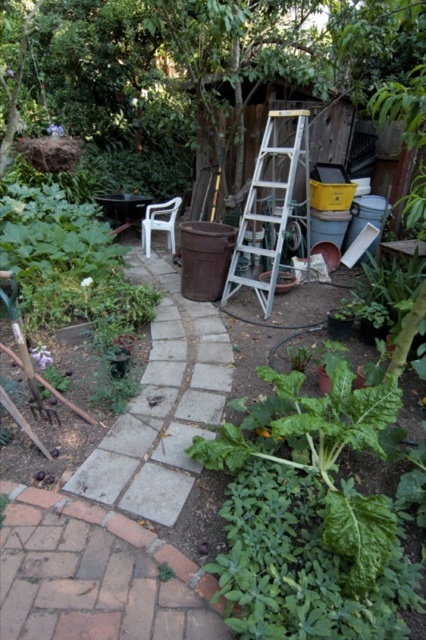
Is gray concrete path at center smaller than white plastic chair at center-left?

Actually, gray concrete path at center might be larger than white plastic chair at center-left.

Between point (81, 468) and point (166, 230), which one is positioned in front?

Point (81, 468) is more forward.

Measure the distance between gray concrete path at center and camera.

They are 6.83 feet apart.

The image size is (426, 640). Identify the location of gray concrete path at center. (163, 406).

Can you confirm if silver metallic ladder at center is bigger than white plastic chair at center-left?

Yes.

Measure the distance between silver metallic ladder at center and white plastic chair at center-left.

silver metallic ladder at center and white plastic chair at center-left are 4.40 feet apart.

I want to click on silver metallic ladder at center, so click(273, 209).

This screenshot has height=640, width=426. I want to click on silver metallic ladder at center, so click(x=273, y=209).

Who is higher up, gray concrete path at center or silver metallic ladder at center?

Positioned higher is silver metallic ladder at center.

Who is more forward, (178, 454) or (273, 212)?

Point (178, 454) is more forward.

Find the location of a particular element. The height and width of the screenshot is (640, 426). gray concrete path at center is located at coordinates (163, 406).